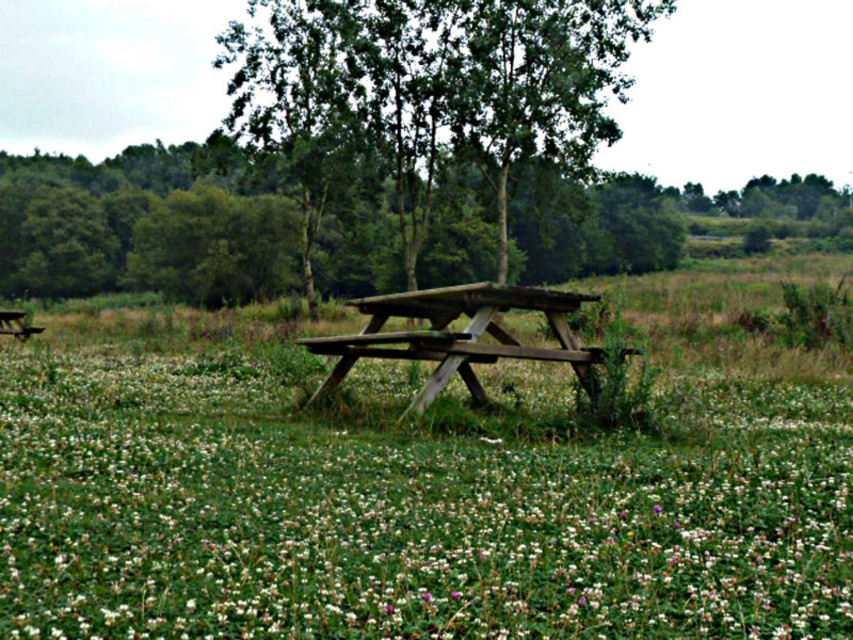
Is green wood tree at center wider than wooden picnic table at center?

Correct, the width of green wood tree at center exceeds that of wooden picnic table at center.

Is point (299, 90) positioned in front of point (560, 300)?

That is False.

I want to click on green wood tree at center, so click(x=434, y=88).

Is white matte flower at center to the right of green wood tree at center from the viewer's perspective?

No, white matte flower at center is not to the right of green wood tree at center.

Is the position of white matte flower at center less distant than that of green wood tree at center?

Yes, white matte flower at center is closer to the viewer.

This screenshot has width=853, height=640. Find the location of `white matte flower at center`. white matte flower at center is located at coordinates (405, 516).

Can you confirm if white matte flower at center is positioned above wooden picnic table at center?

No, white matte flower at center is not above wooden picnic table at center.

Can you confirm if white matte flower at center is positioned to the right of wooden picnic table at center?

Correct, you'll find white matte flower at center to the right of wooden picnic table at center.

Who is more forward, (x=734, y=513) or (x=560, y=333)?

Point (x=734, y=513) is in front.

I want to click on white matte flower at center, so click(x=405, y=516).